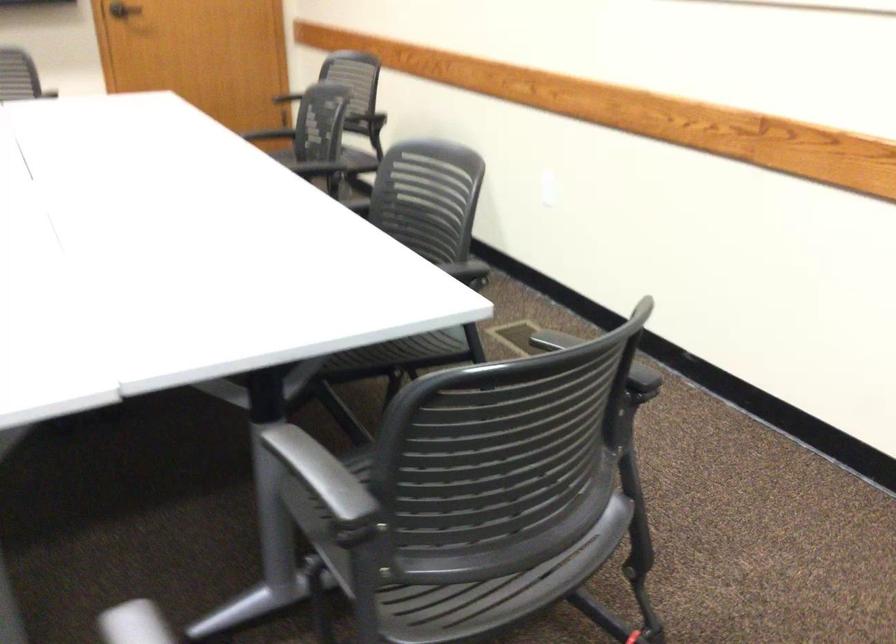
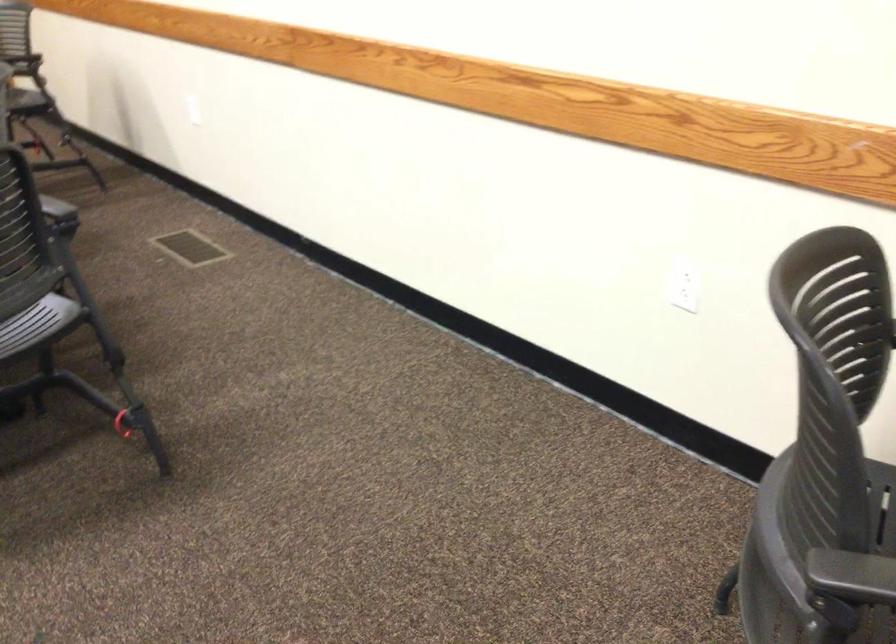
Question: How did the camera likely rotate?

Choices:
 (A) Left
 (B) Right
 (C) Up
 (D) Down

Answer: (B)